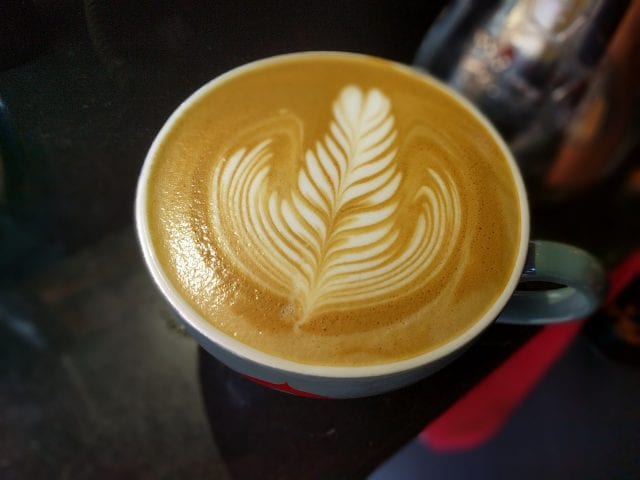
Image resolution: width=640 pixels, height=480 pixels. Identify the location of dark brown table. (186, 400).